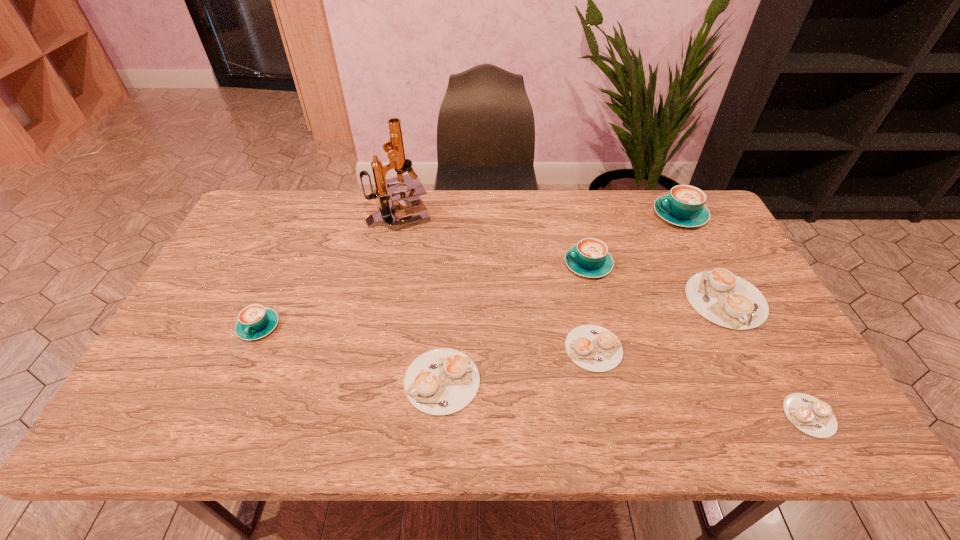
The width and height of the screenshot is (960, 540). Find the location of `free location located 0.080m with the handle on the right side of the second biggest turquoise cappuccino`. free location located 0.080m with the handle on the right side of the second biggest turquoise cappuccino is located at coordinates (x=538, y=265).

Find the location of a particular element. blank area located with the handle on the right side of the second biggest turquoise cappuccino is located at coordinates (538, 265).

Where is `free space located 0.390m with the handle on the right side of the second biggest turquoise cappuccino`? free space located 0.390m with the handle on the right side of the second biggest turquoise cappuccino is located at coordinates (435, 265).

Locate an element on the screen. The image size is (960, 540). vacant area located with the handle on the right side of the fifth shortest cappuccino is located at coordinates (214, 429).

This screenshot has height=540, width=960. Find the location of `vacant area situated on the left of the biggest white cappuccino`. vacant area situated on the left of the biggest white cappuccino is located at coordinates (558, 300).

This screenshot has width=960, height=540. I want to click on vacant region located on the right of the third smallest white cappuccino, so click(585, 381).

Find the location of a particular element. vacant space located on the left of the sixth tallest cappuccino is located at coordinates (419, 348).

The height and width of the screenshot is (540, 960). Identify the location of free space located on the back of the smallest white cappuccino. (755, 317).

Locate an element on the screen. The image size is (960, 540). microscope positioned at the far edge is located at coordinates (385, 189).

Where is `cappuccino that is at the far edge`? The image size is (960, 540). cappuccino that is at the far edge is located at coordinates 684,206.